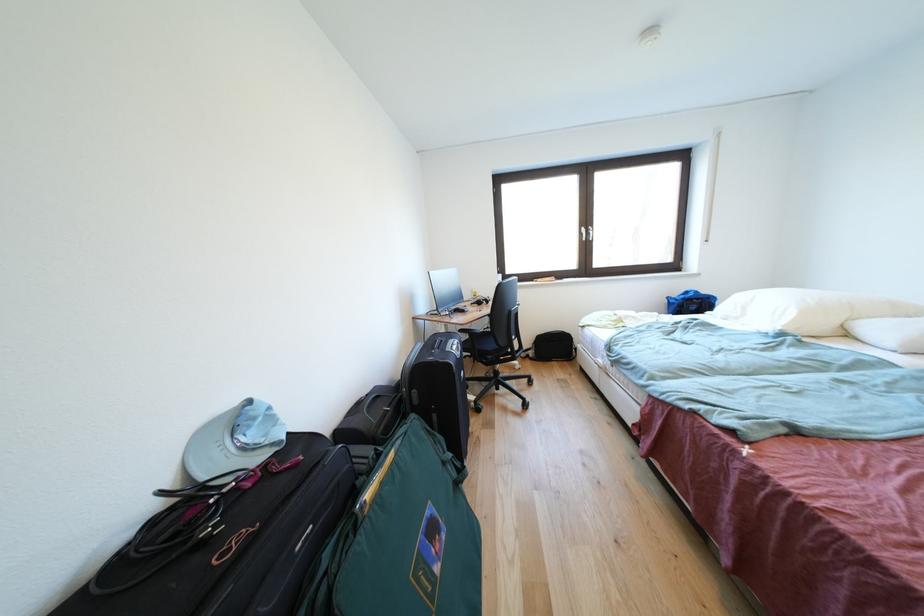
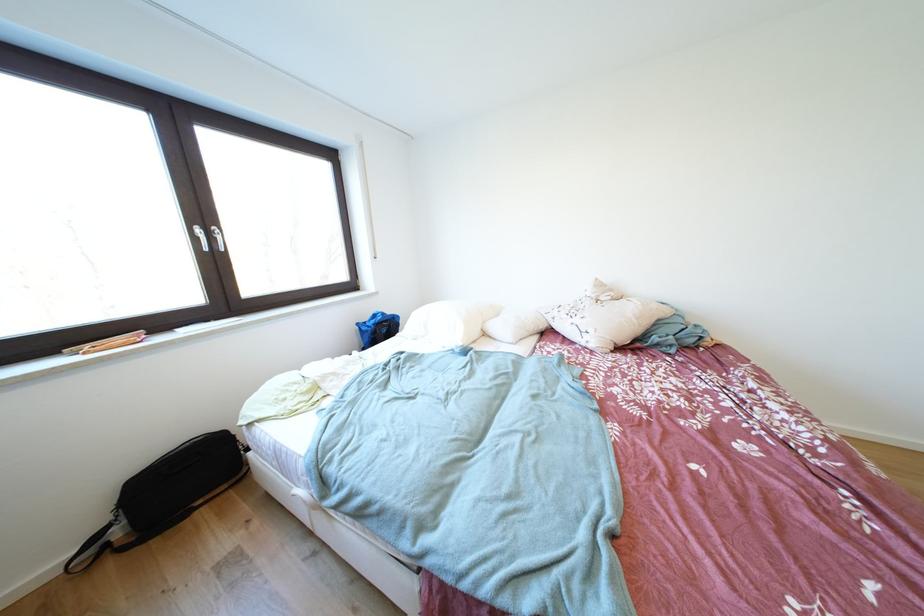
The point at (x=675, y=302) is marked in the first image. Where is the corresponding point in the second image?

(367, 329)